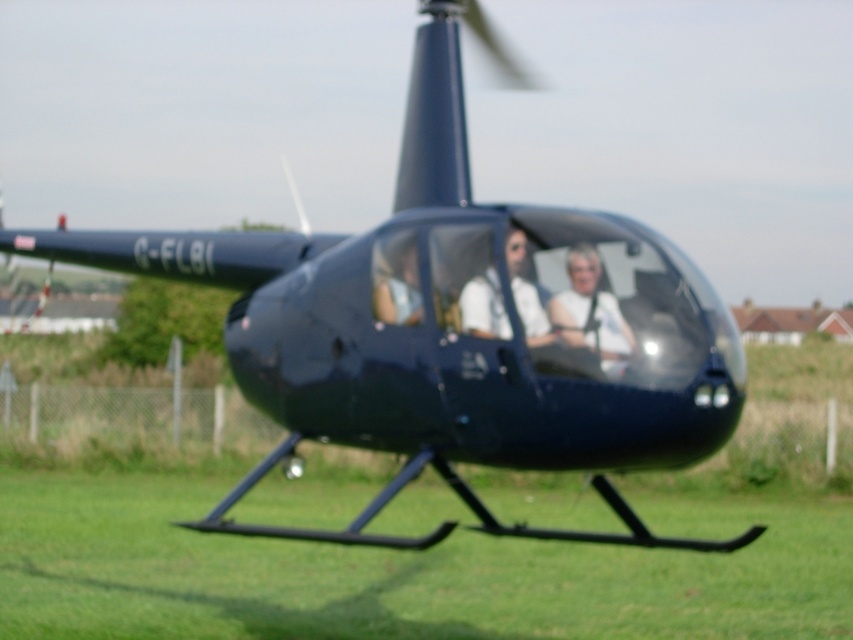
Based on the scene, which object is shorter between the green grass at lower center and the white matte shirt at center?

The green grass at lower center is shorter than the white matte shirt at center.

You are standing at the point marked by the coordinates point [590,312] in the image. What object are you standing on?

The point [590,312] marks the white matte shirt at center, so you are standing on the white matte shirt at center.

Based on the photo, you are a flight attendant on the helicopter and need to hand over a document to the passenger wearing the white glossy shirt at center. The document is currently on the seat of the person wearing the white matte shirt at center. Can you reach the document without moving from your current position?

The distance between the white matte shirt at center and the white glossy shirt at center is 7.67 inches. Since the shirts are very close, you can likely reach the document without moving from your position.